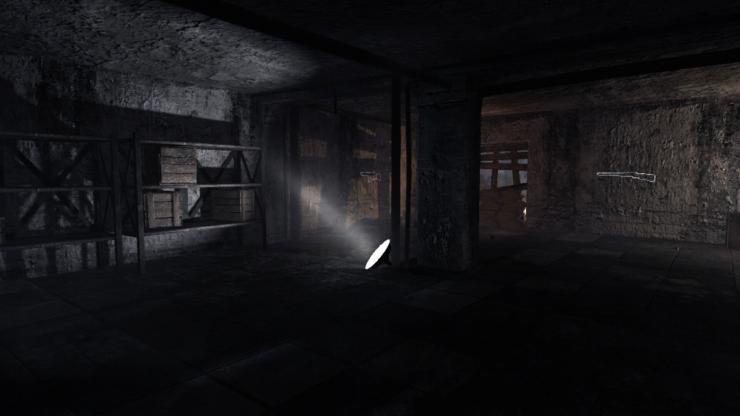
Identify the location of pillar. Image resolution: width=740 pixels, height=416 pixels. (464, 181).